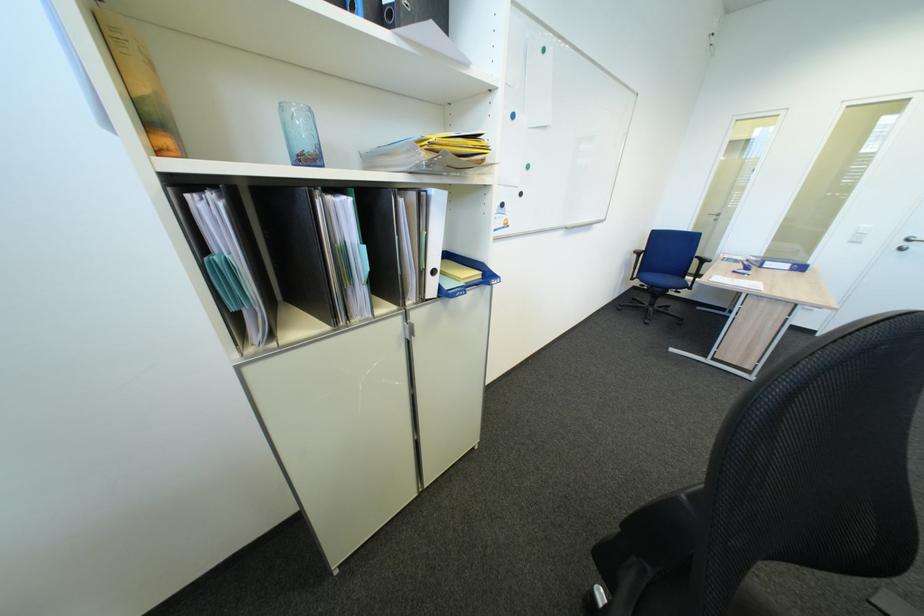
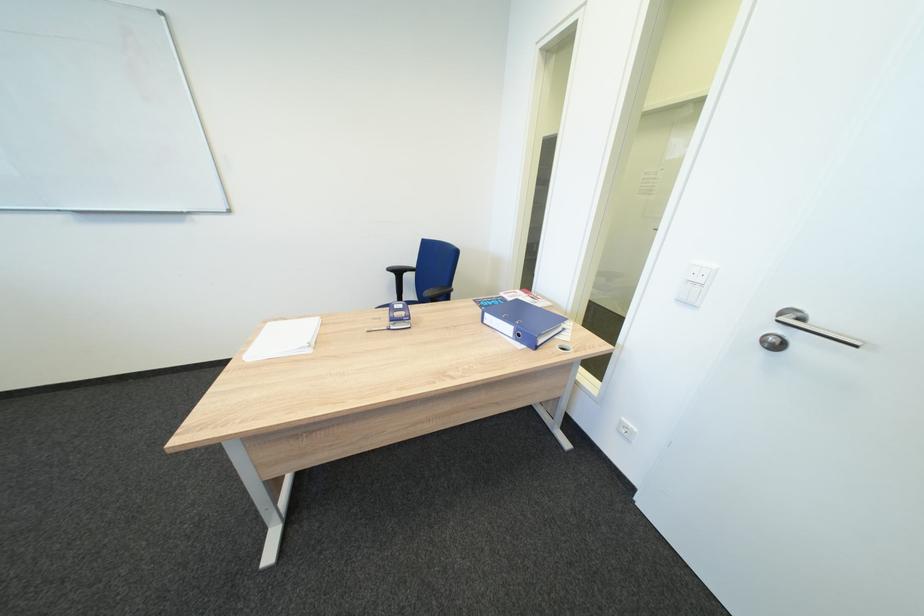
Locate, in the second image, the point that corresponds to (646,254) in the first image.

(400, 270)